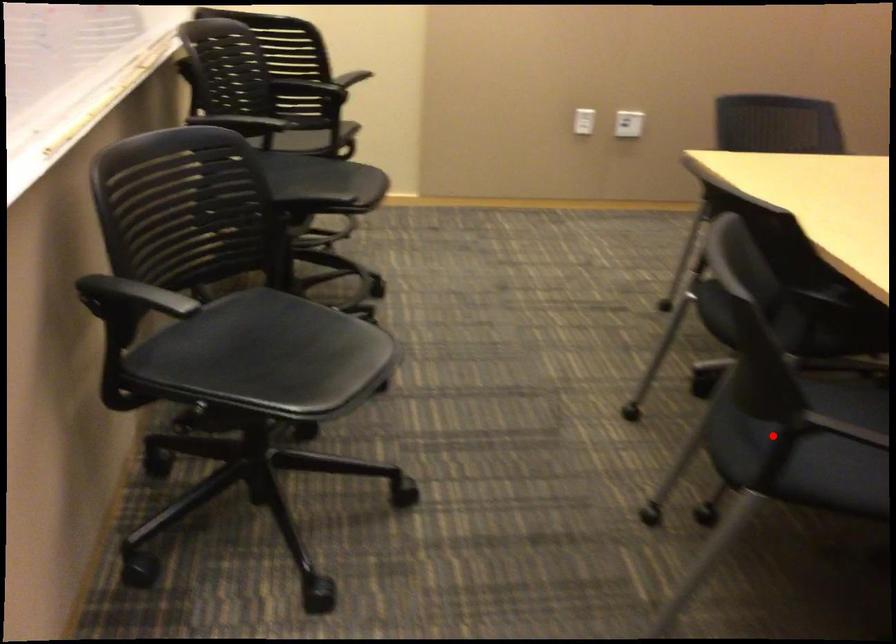
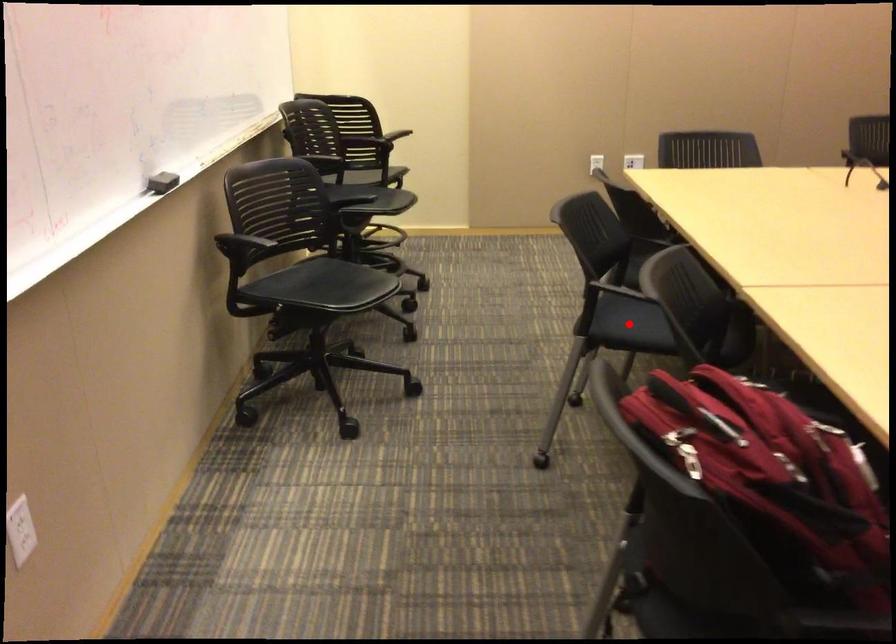
I am providing you with two images of the same scene from different viewpoints. A red point is marked on the first image and another point is marked on the second image. Is the marked point in image1 the same physical position as the marked point in image2?

Yes